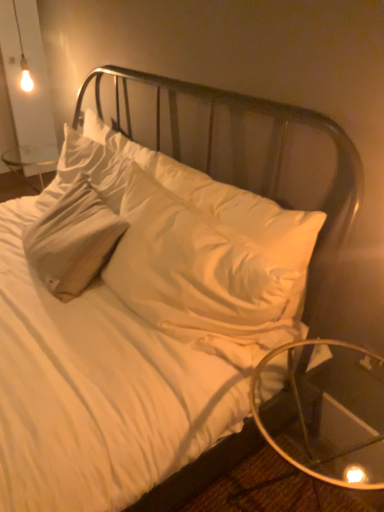
In order to face white soft pillow at center, should I rotate leftwards or rightwards?

Rotate your view right by about 3.234°.

You are a GUI agent. You are given a task and a screenshot of the screen. Output one action in this format:
    pyautogui.click(x=<x>, y=<y>)
    Task: Click on the white soft pillow at center
    The width and height of the screenshot is (384, 512).
    Given the screenshot: What is the action you would take?
    pyautogui.click(x=229, y=208)

This screenshot has width=384, height=512. Describe the element at coordinates (229, 208) in the screenshot. I see `white soft pillow at center` at that location.

Where is `transparent glass table at lower right`? Image resolution: width=384 pixels, height=512 pixels. transparent glass table at lower right is located at coordinates (324, 410).

In the scene shown: What is the approximate width of transparent glass table at lower right?

transparent glass table at lower right is 15.61 inches in width.

Measure the distance between transparent glass table at lower right and camera.

transparent glass table at lower right and camera are 77.58 centimeters apart from each other.

Describe the element at coordinates (324, 410) in the screenshot. I see `transparent glass table at lower right` at that location.

Locate an element on the screen. This screenshot has width=384, height=512. white soft pillow at center is located at coordinates (229, 208).

Considering the positions of objects transparent glass table at lower right and white soft pillow at center in the image provided, who is more to the right, transparent glass table at lower right or white soft pillow at center?

transparent glass table at lower right is more to the right.

Is transparent glass table at lower right further to camera compared to white soft pillow at center?

No, the depth of transparent glass table at lower right is less than that of white soft pillow at center.

Does point (343, 384) come behind point (204, 194)?

Yes.

From the image's perspective, is transparent glass table at lower right over white soft pillow at center?

No, from the image's perspective, transparent glass table at lower right is not above white soft pillow at center.

From a real-world perspective, is transparent glass table at lower right positioned above or below white soft pillow at center?

Clearly, from a real-world perspective, transparent glass table at lower right is below white soft pillow at center.

Can you confirm if transparent glass table at lower right is thinner than white soft pillow at center?

In fact, transparent glass table at lower right might be wider than white soft pillow at center.

Between transparent glass table at lower right and white soft pillow at center, which one has less height?

transparent glass table at lower right.

Based on the photo, who is bigger, transparent glass table at lower right or white soft pillow at center?

Bigger between the two is white soft pillow at center.

Choose the correct answer: Is transparent glass table at lower right inside white soft pillow at center or outside it?

The correct answer is: outside.

Can you see transparent glass table at lower right touching white soft pillow at center?

transparent glass table at lower right and white soft pillow at center are not in contact.

Is transparent glass table at lower right aimed at white soft pillow at center?

No, transparent glass table at lower right is not facing towards white soft pillow at center.

How distant is transparent glass table at lower right from white soft pillow at center?

They are 16.16 inches apart.

Find the location of `table on the right of the white soft pillow at center`. table on the right of the white soft pillow at center is located at coordinates (324, 410).

Between white soft pillow at center and transparent glass table at lower right, which one appears on the right side from the viewer's perspective?

Positioned to the right is transparent glass table at lower right.

Consider the image. Is white soft pillow at center closer to camera compared to transparent glass table at lower right?

No, white soft pillow at center is further to the viewer.

Which is in front, point (308, 256) or point (258, 368)?

The point (258, 368) is in front.

Looking at this image, from the image's perspective, relative to transparent glass table at lower right, is white soft pillow at center above or below?

Based on their image positions, white soft pillow at center is located above transparent glass table at lower right.

From a real-world perspective, between white soft pillow at center and transparent glass table at lower right, who is vertically lower?

In real-world perspective, transparent glass table at lower right is lower.

Between white soft pillow at center and transparent glass table at lower right, which one has smaller width?

With smaller width is white soft pillow at center.

Considering the relative sizes of white soft pillow at center and transparent glass table at lower right in the image provided, is white soft pillow at center shorter than transparent glass table at lower right?

In fact, white soft pillow at center may be taller than transparent glass table at lower right.

Considering the relative sizes of white soft pillow at center and transparent glass table at lower right in the image provided, is white soft pillow at center smaller than transparent glass table at lower right?

Actually, white soft pillow at center might be larger than transparent glass table at lower right.

Is transparent glass table at lower right surrounded by white soft pillow at center?

Definitely not — transparent glass table at lower right is not inside white soft pillow at center.

Is white soft pillow at center far away from transparent glass table at lower right?

No, white soft pillow at center is not far from transparent glass table at lower right.

Is white soft pillow at center oriented away from transparent glass table at lower right?

That's not correct — white soft pillow at center is not looking away from transparent glass table at lower right.

What's the angular difference between white soft pillow at center and transparent glass table at lower right's facing directions?

Result: 3.59 degrees separate the facing orientations of white soft pillow at center and transparent glass table at lower right.

Measure the distance between white soft pillow at center and transparent glass table at lower right.

A distance of 16.16 inches exists between white soft pillow at center and transparent glass table at lower right.

This screenshot has height=512, width=384. I want to click on table on the right of white soft pillow at center, so (x=324, y=410).

Identify the location of pillow above the transparent glass table at lower right (from a real-world perspective). The width and height of the screenshot is (384, 512). (229, 208).

The image size is (384, 512). What are the coordinates of `table below the white soft pillow at center (from a real-world perspective)` in the screenshot? It's located at (324, 410).